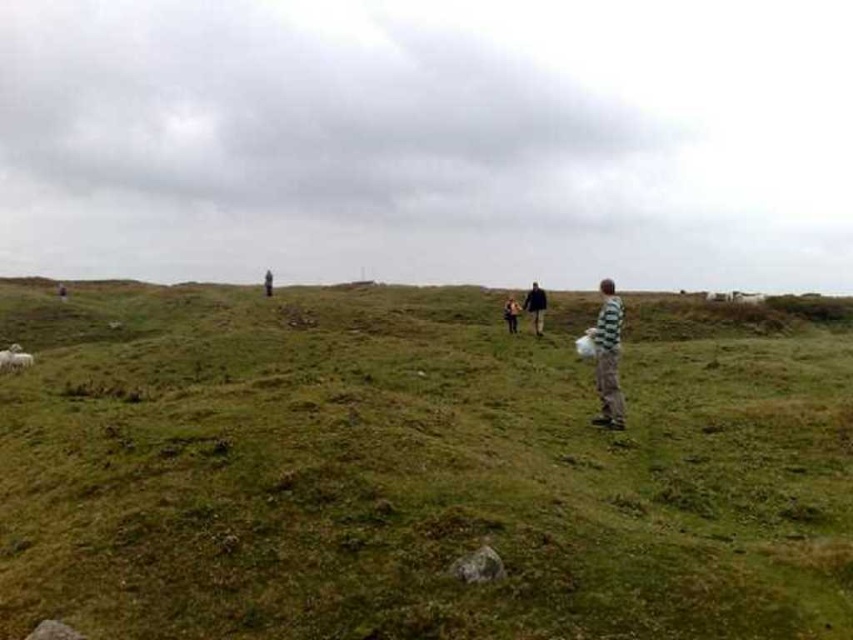
Measure the distance from green grassy field at center to dark brown leather jacket at center.

The distance of green grassy field at center from dark brown leather jacket at center is 194.34 meters.

How much distance is there between green grassy field at center and dark brown leather jacket at center?

A distance of 637.59 feet exists between green grassy field at center and dark brown leather jacket at center.

Identify the location of green grassy field at center. This screenshot has height=640, width=853. (416, 467).

This screenshot has width=853, height=640. What are the coordinates of `green grassy field at center` in the screenshot? It's located at (416, 467).

Who is positioned more to the left, green grassy field at center or dark green jacket at center?

From the viewer's perspective, dark green jacket at center appears more on the left side.

Which of these two, green grassy field at center or dark green jacket at center, stands taller?

green grassy field at center is taller.

Which is behind, point (502, 580) or point (270, 276)?

The point (270, 276) is behind.

Identify the location of green grassy field at center. (416, 467).

Is striped fabric person at right bigger than green striped shirt at center?

Correct, striped fabric person at right is larger in size than green striped shirt at center.

Which is below, striped fabric person at right or green striped shirt at center?

striped fabric person at right

Does point (595, 356) come farther from viewer compared to point (502, 316)?

No, it is in front of (502, 316).

Find the location of `striped fabric person at right`. striped fabric person at right is located at coordinates (608, 356).